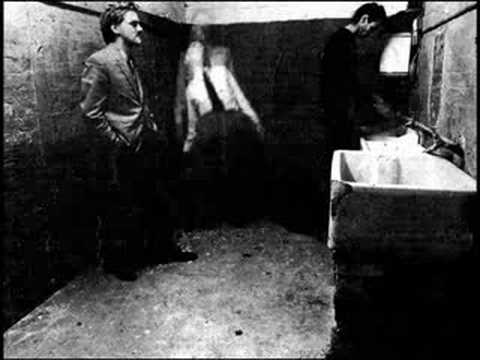
The width and height of the screenshot is (480, 360). Find the location of `faucet`. faucet is located at coordinates (438, 142).